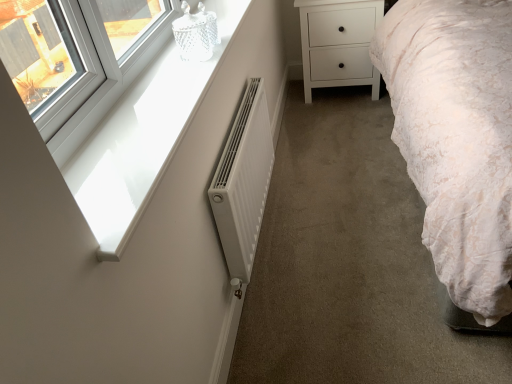
Question: Is white matte chest of drawers at center not within white matte radiator at center?

Choices:
 (A) yes
 (B) no

Answer: (A)

Question: Considering the relative positions of white matte chest of drawers at center and white matte radiator at center in the image provided, is white matte chest of drawers at center to the right of white matte radiator at center from the viewer's perspective?

Choices:
 (A) no
 (B) yes

Answer: (B)

Question: Considering the relative sizes of white matte chest of drawers at center and white matte radiator at center in the image provided, is white matte chest of drawers at center smaller than white matte radiator at center?

Choices:
 (A) no
 (B) yes

Answer: (A)

Question: From a real-world perspective, is white matte chest of drawers at center positioned over white matte radiator at center based on gravity?

Choices:
 (A) yes
 (B) no

Answer: (B)

Question: Is white matte radiator at center at the back of white matte chest of drawers at center?

Choices:
 (A) yes
 (B) no

Answer: (B)

Question: From the image's perspective, would you say white matte chest of drawers at center is positioned over white matte radiator at center?

Choices:
 (A) no
 (B) yes

Answer: (B)

Question: Are white matte radiator at center and white glossy window sill at upper left far apart?

Choices:
 (A) no
 (B) yes

Answer: (A)

Question: Does white matte radiator at center turn towards white glossy window sill at upper left?

Choices:
 (A) yes
 (B) no

Answer: (B)

Question: Is white matte radiator at center outside white glossy window sill at upper left?

Choices:
 (A) yes
 (B) no

Answer: (A)

Question: Is white glossy window sill at upper left located within white matte radiator at center?

Choices:
 (A) yes
 (B) no

Answer: (B)

Question: From a real-world perspective, does white matte radiator at center sit lower than white glossy window sill at upper left?

Choices:
 (A) yes
 (B) no

Answer: (A)

Question: From a real-world perspective, is white matte radiator at center on white glossy window sill at upper left?

Choices:
 (A) no
 (B) yes

Answer: (A)

Question: From the image's perspective, is white matte radiator at center under white matte chest of drawers at center?

Choices:
 (A) no
 (B) yes

Answer: (B)